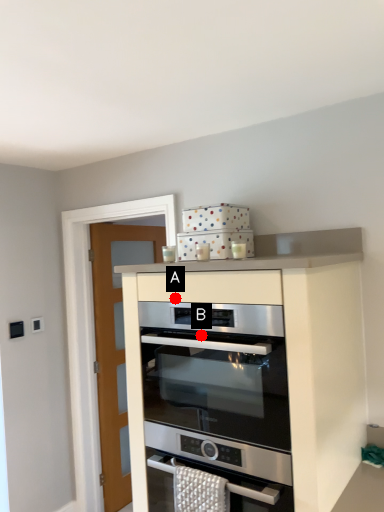
Question: Two points are circled on the image, labeled by A and B beside each circle. Which point is farther to the camera?

Choices:
 (A) A is further
 (B) B is further

Answer: (A)